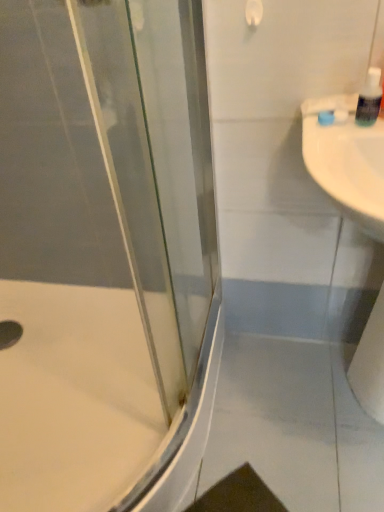
Question: Is white glossy sink at right wider than white matte toilet paper at right?

Choices:
 (A) no
 (B) yes

Answer: (B)

Question: Considering the relative sizes of white glossy sink at right and white matte toilet paper at right in the image provided, is white glossy sink at right thinner than white matte toilet paper at right?

Choices:
 (A) no
 (B) yes

Answer: (A)

Question: Is white glossy sink at right positioned in front of white matte toilet paper at right?

Choices:
 (A) no
 (B) yes

Answer: (B)

Question: From the image's perspective, does white glossy sink at right appear higher than white matte toilet paper at right?

Choices:
 (A) yes
 (B) no

Answer: (A)

Question: Considering the relative sizes of white glossy sink at right and white matte toilet paper at right in the image provided, is white glossy sink at right shorter than white matte toilet paper at right?

Choices:
 (A) yes
 (B) no

Answer: (A)

Question: From the image's perspective, is white glossy bath at lower left positioned above or below clear plastic soap dispenser at upper right?

Choices:
 (A) above
 (B) below

Answer: (B)

Question: Considering the positions of white glossy bath at lower left and clear plastic soap dispenser at upper right in the image, is white glossy bath at lower left taller or shorter than clear plastic soap dispenser at upper right?

Choices:
 (A) short
 (B) tall

Answer: (B)

Question: Would you say white glossy bath at lower left is inside or outside clear plastic soap dispenser at upper right?

Choices:
 (A) inside
 (B) outside

Answer: (B)

Question: In the image, is white glossy bath at lower left on the left side or the right side of clear plastic soap dispenser at upper right?

Choices:
 (A) left
 (B) right

Answer: (A)

Question: Considering the positions of point (155, 494) and point (380, 150), is point (155, 494) closer or farther from the camera than point (380, 150)?

Choices:
 (A) farther
 (B) closer

Answer: (A)

Question: From the image's perspective, is transparent glass shower door at left above or below white glossy sink at right?

Choices:
 (A) above
 (B) below

Answer: (B)

Question: From a real-world perspective, is transparent glass shower door at left positioned above or below white glossy sink at right?

Choices:
 (A) above
 (B) below

Answer: (B)

Question: Based on their positions, is transparent glass shower door at left located to the left or right of white glossy sink at right?

Choices:
 (A) left
 (B) right

Answer: (A)

Question: Is white matte toilet paper at right taller or shorter than transparent glass shower door at left?

Choices:
 (A) short
 (B) tall

Answer: (A)

Question: From a real-world perspective, is white matte toilet paper at right physically located above or below transparent glass shower door at left?

Choices:
 (A) above
 (B) below

Answer: (B)